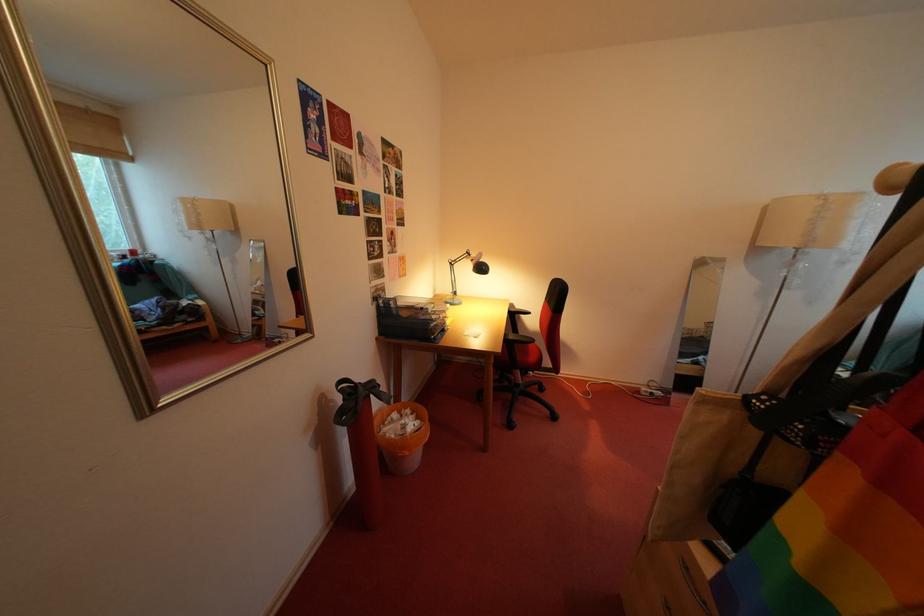
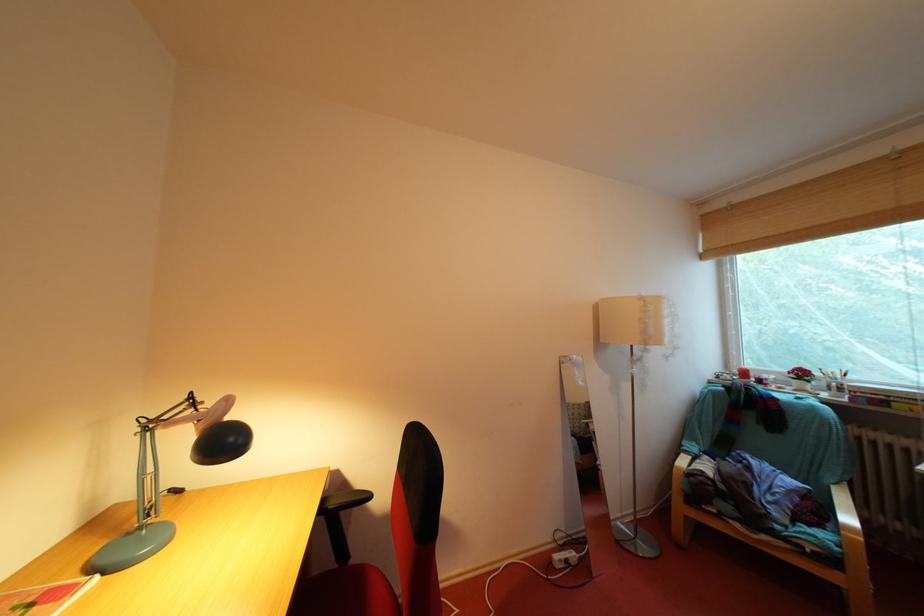
The first image is from the beginning of the video and the second image is from the end. How did the camera likely rotate when shooting the video?

The camera's rotation is toward right-up.